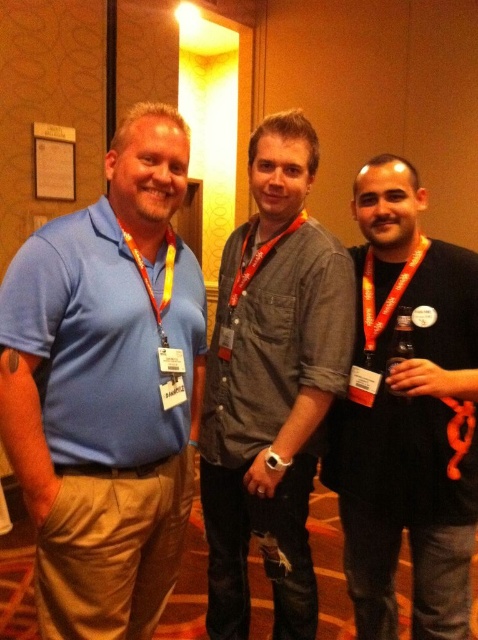
Question: Which point is closer to the camera?

Choices:
 (A) (394, 253)
 (B) (47, 300)

Answer: (B)

Question: Which point is farther to the camera?

Choices:
 (A) matte blue shirt at left
 (B) gray fabric shirt at center
 (C) gray cotton shirt at center
 (D) black matte shirt at right

Answer: (B)

Question: Does black matte shirt at right have a larger size compared to gray fabric shirt at center?

Choices:
 (A) no
 (B) yes

Answer: (B)

Question: Does black matte shirt at right appear on the right side of orange fabric lanyard at center?

Choices:
 (A) yes
 (B) no

Answer: (A)

Question: Is black matte shirt at right to the left of orange fabric lanyard at center from the viewer's perspective?

Choices:
 (A) yes
 (B) no

Answer: (B)

Question: Which of these objects is positioned farthest from the orange fabric lanyard at center?

Choices:
 (A) black matte shirt at right
 (B) gray cotton shirt at center
 (C) matte black lanyard at center
 (D) gray fabric shirt at center

Answer: (A)